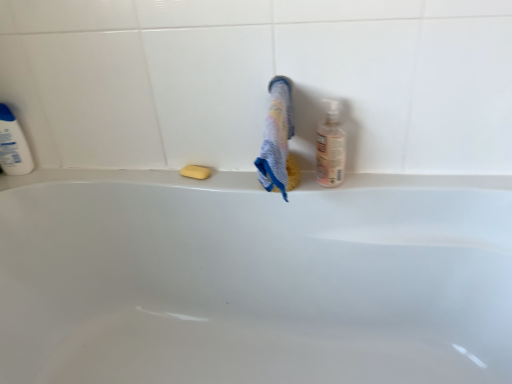
Locate an element on the screen. This screenshot has height=384, width=512. vacant space that is in between white plastic bottle at left, the 2th cleaning product in the right-to-left sequence, and translucent plastic bottle at right, arranged as the 2th cleaning product when viewed from the back is located at coordinates (147, 172).